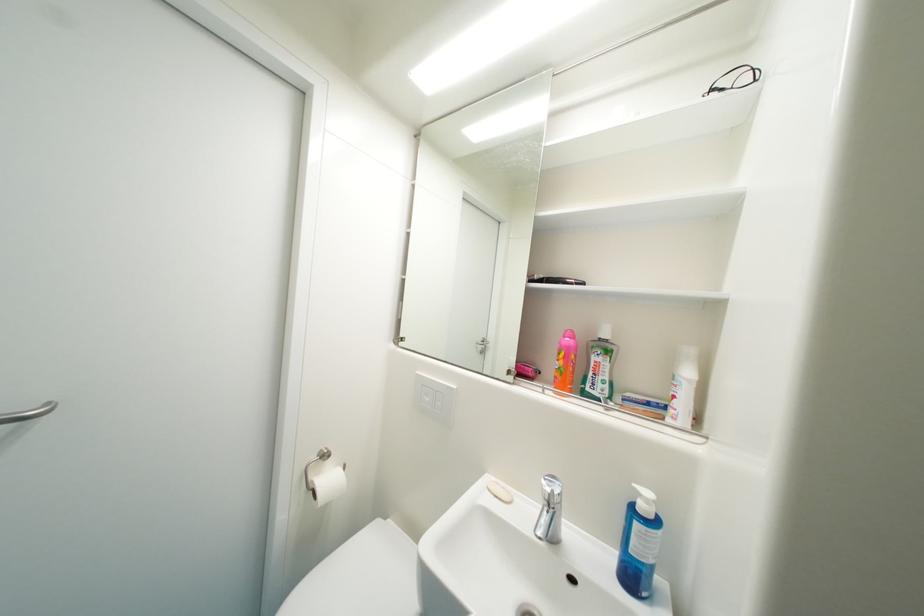
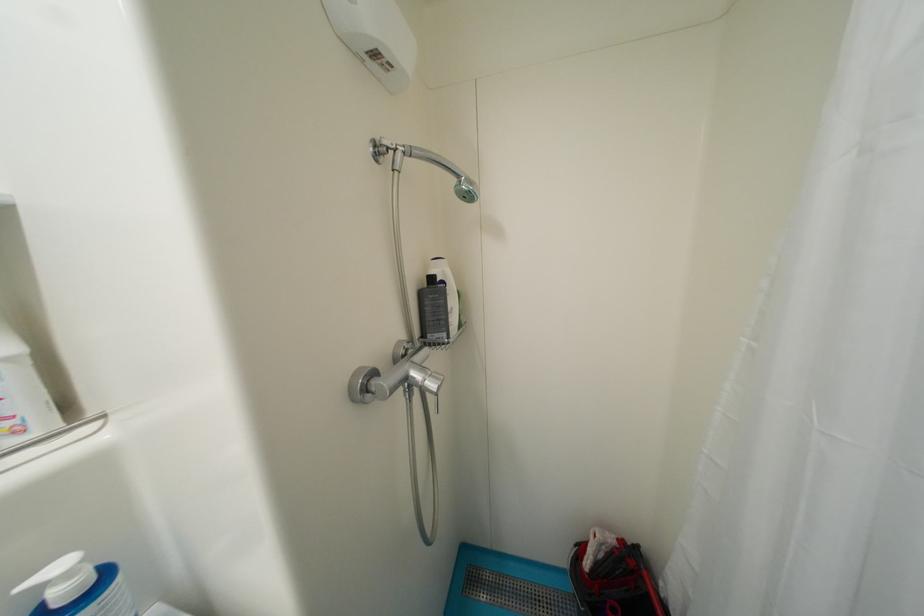
The point at (653, 503) is marked in the first image. Where is the corresponding point in the second image?

(75, 576)